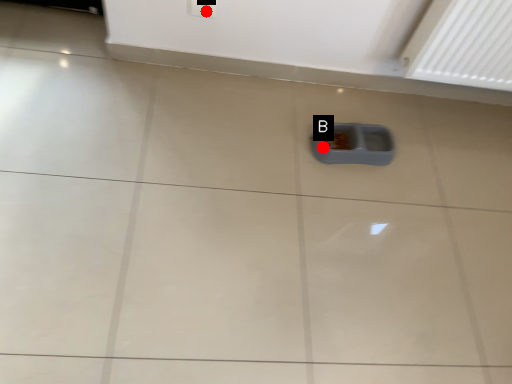
Question: Two points are circled on the image, labeled by A and B beside each circle. Which point appears farthest from the camera in this image?

Choices:
 (A) A is further
 (B) B is further

Answer: (B)